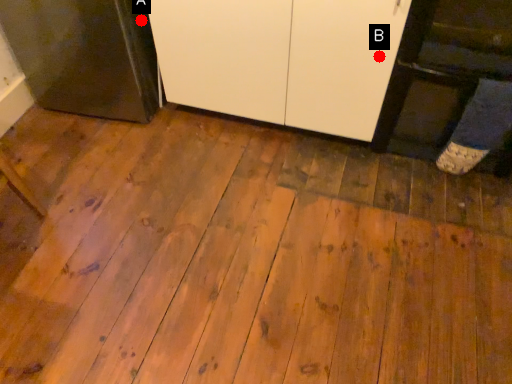
Question: Two points are circled on the image, labeled by A and B beside each circle. Among these points, which one is nearest to the camera?

Choices:
 (A) A is closer
 (B) B is closer

Answer: (B)